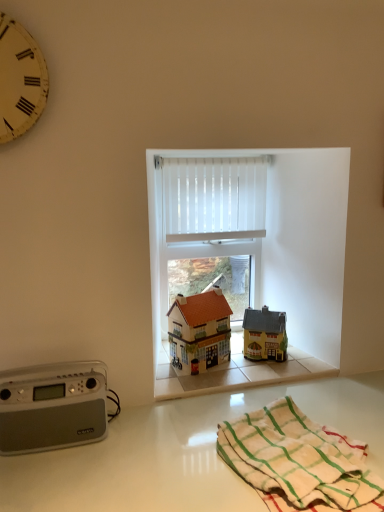
Image resolution: width=384 pixels, height=512 pixels. I want to click on vacant space situated on the left part of white cotton towel at lower right, so click(160, 464).